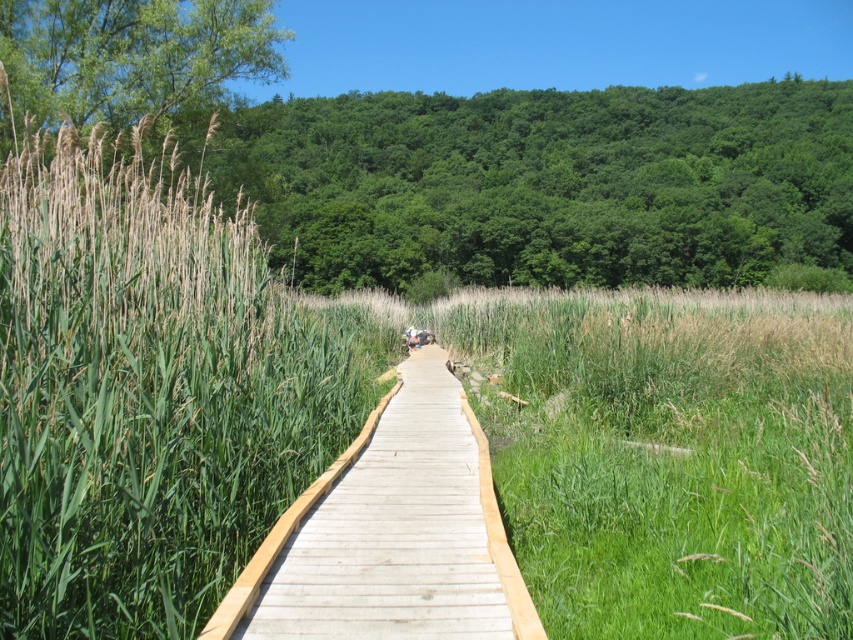
Question: Can you confirm if green grass at center is positioned to the right of wooden boardwalk at center?

Choices:
 (A) no
 (B) yes

Answer: (B)

Question: Which of the following is the closest to the observer?

Choices:
 (A) (486, 496)
 (B) (778, 544)

Answer: (B)

Question: In this image, where is green grass at center located relative to wooden boardwalk at center?

Choices:
 (A) right
 (B) left

Answer: (A)

Question: Which object is farther from the camera taking this photo?

Choices:
 (A) green grass at center
 (B) wooden boardwalk at center

Answer: (B)

Question: Can you confirm if green grass at center is positioned below wooden boardwalk at center?

Choices:
 (A) yes
 (B) no

Answer: (B)